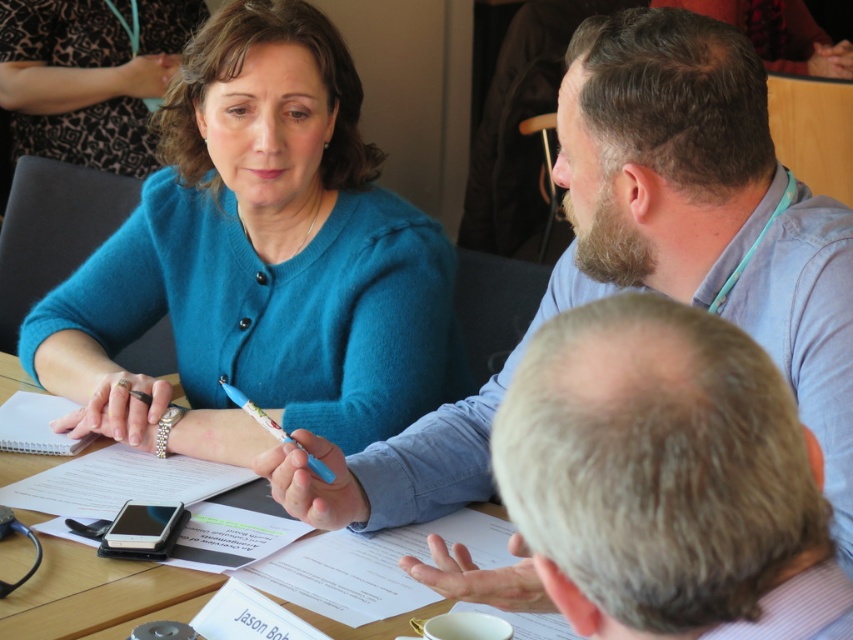
You are standing at the camera position and want to hand a document to the blue fabric shirt at upper center. Can you reach them without moving from your current position?

The blue fabric shirt at upper center is 78.00 centimeters from the camera, so you can reach them without moving from your current position.

You are a photographer trying to capture a candid shot of the meeting. You notice the teal fuzzy sweater at upper left and the gray hair at upper center. Which object should you focus on to ensure it appears larger in your photo?

The teal fuzzy sweater at upper left is taller than the gray hair at upper center, so focusing on it will result in a larger appearance in the photo.

In the scene of a professional meeting at a conference table, there is a man with gray hair at upper center and a white paper notepad at upper left. Which object occupies more horizontal space in the image?

The gray hair at upper center occupies more horizontal space than the white paper notepad at upper left, as its width surpasses that of the notepad.